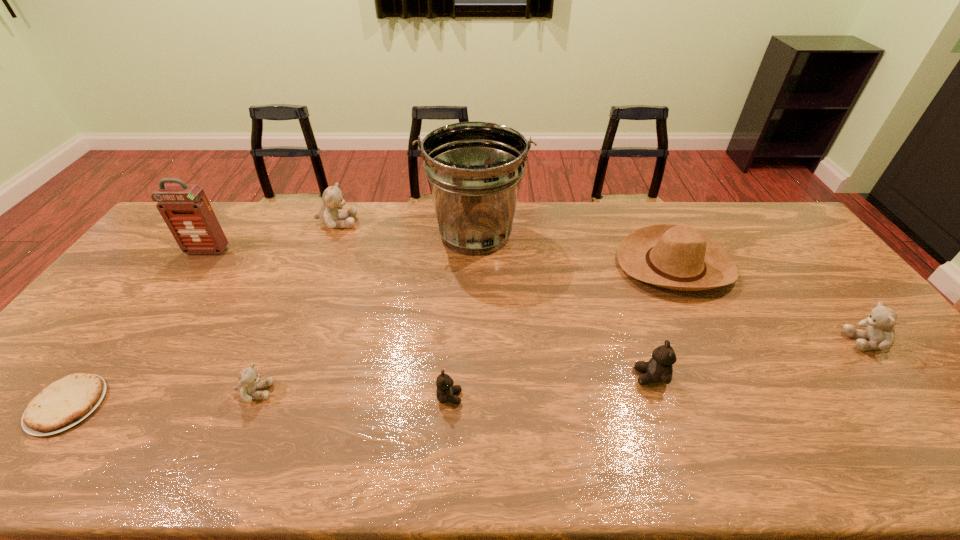
This screenshot has height=540, width=960. Find the location of `object that ranks as the eighth closest to the farthest teddy bear`. object that ranks as the eighth closest to the farthest teddy bear is located at coordinates (880, 332).

Where is `the fourth closest teddy bear relative to the smallest gray teddy bear`? The height and width of the screenshot is (540, 960). the fourth closest teddy bear relative to the smallest gray teddy bear is located at coordinates (880, 332).

Locate an element on the screen. The height and width of the screenshot is (540, 960). teddy bear that is the closest one to the biggest gray teddy bear is located at coordinates (249, 380).

Choose which gray teddy bear is the second nearest neighbor to the smallest gray teddy bear. Please provide its 2D coordinates. Your answer should be formatted as a tuple, i.e. [(x, y)], where the tuple contains the x and y coordinates of a point satisfying the conditions above.

[(880, 332)]

Where is `gray teddy bear that is the closest to the smaller brown teddy bear`? The height and width of the screenshot is (540, 960). gray teddy bear that is the closest to the smaller brown teddy bear is located at coordinates (249, 380).

I want to click on blank space that satisfies the following two spatial constraints: 1. on the back side of the bucket; 2. on the face of the tallest teddy bear, so click(475, 223).

Locate an element on the screen. This screenshot has height=540, width=960. free space that satisfies the following two spatial constraints: 1. on the front-facing side of the brown cowboy hat; 2. on the face of the smallest gray teddy bear is located at coordinates (736, 392).